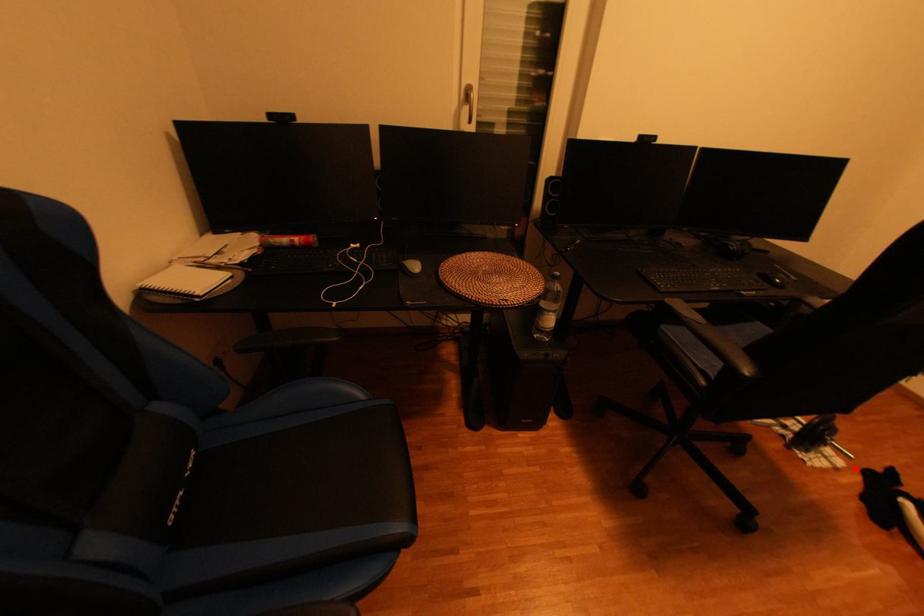
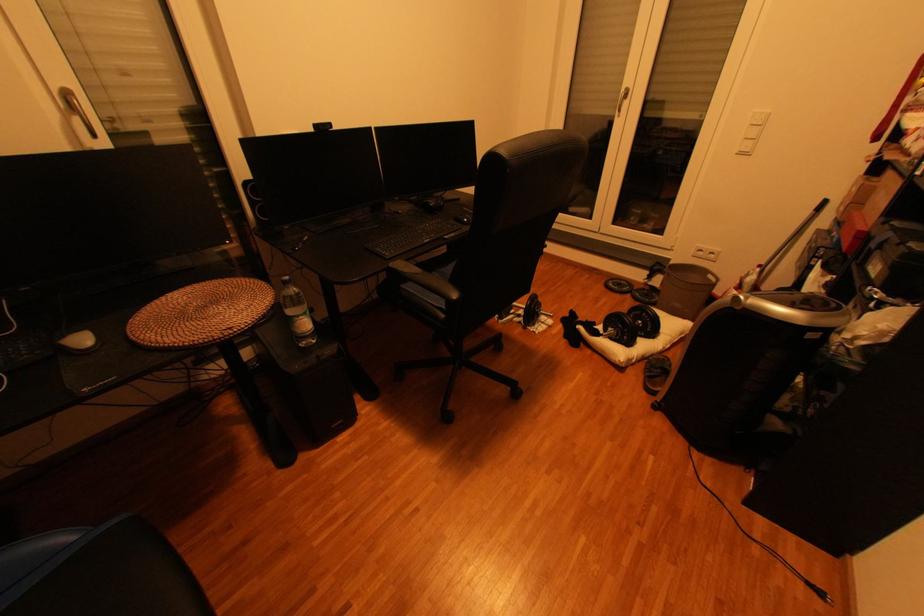
Where in the second image is the point corresponding to the highlighted location from the first image?

(564, 323)